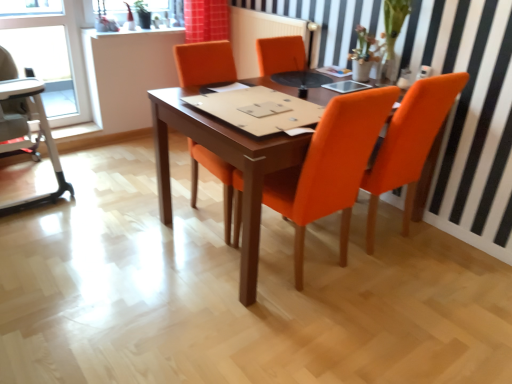
Question: Is wooden table at center closer to the viewer compared to beige fabric high chair at left?

Choices:
 (A) yes
 (B) no

Answer: (A)

Question: Can you confirm if wooden table at center is taller than beige fabric high chair at left?

Choices:
 (A) yes
 (B) no

Answer: (B)

Question: Is wooden table at center far away from beige fabric high chair at left?

Choices:
 (A) yes
 (B) no

Answer: (A)

Question: Does wooden table at center have a greater width compared to beige fabric high chair at left?

Choices:
 (A) no
 (B) yes

Answer: (B)

Question: Considering the relative sizes of wooden table at center and beige fabric high chair at left in the image provided, is wooden table at center shorter than beige fabric high chair at left?

Choices:
 (A) yes
 (B) no

Answer: (A)

Question: From a real-world perspective, is wooden table at center located beneath beige fabric high chair at left?

Choices:
 (A) yes
 (B) no

Answer: (A)

Question: Is transparent glass window at upper left positioned before orange fabric chair at right, the 1th chair from the right?

Choices:
 (A) yes
 (B) no

Answer: (B)

Question: Is transparent glass window at upper left turned away from orange fabric chair at right, which is the 2th chair in left-to-right order?

Choices:
 (A) no
 (B) yes

Answer: (A)

Question: Is transparent glass window at upper left bigger than orange fabric chair at right, which is the 2th chair in left-to-right order?

Choices:
 (A) no
 (B) yes

Answer: (A)

Question: Is transparent glass window at upper left aimed at orange fabric chair at right, which is the 2th chair in left-to-right order?

Choices:
 (A) yes
 (B) no

Answer: (B)

Question: Does transparent glass window at upper left have a lesser height compared to orange fabric chair at right, the 1th chair from the right?

Choices:
 (A) yes
 (B) no

Answer: (A)

Question: Would you say transparent glass window at upper left is outside orange fabric chair at right, the 1th chair from the right?

Choices:
 (A) yes
 (B) no

Answer: (A)

Question: From the image's perspective, would you say beige fabric high chair at left is positioned over wooden table at center?

Choices:
 (A) yes
 (B) no

Answer: (A)